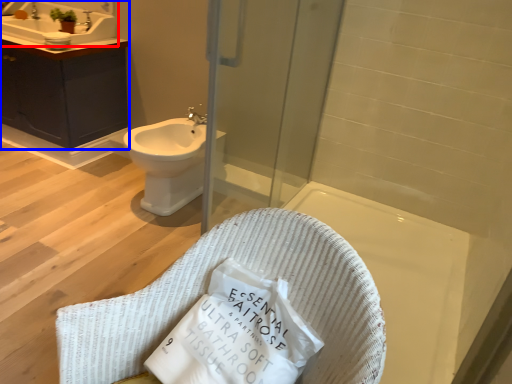
Question: Among these objects, which one is farthest to the camera, sink (highlighted by a red box) or bathroom cabinet (highlighted by a blue box)?

Choices:
 (A) sink
 (B) bathroom cabinet

Answer: (A)